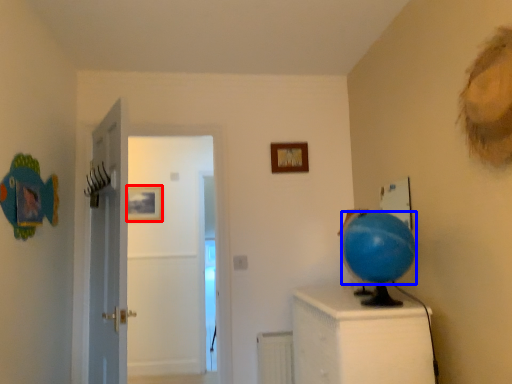
Question: Which point is closer to the camera, picture frame (highlighted by a red box) or balloon (highlighted by a blue box)?

Choices:
 (A) picture frame
 (B) balloon

Answer: (B)